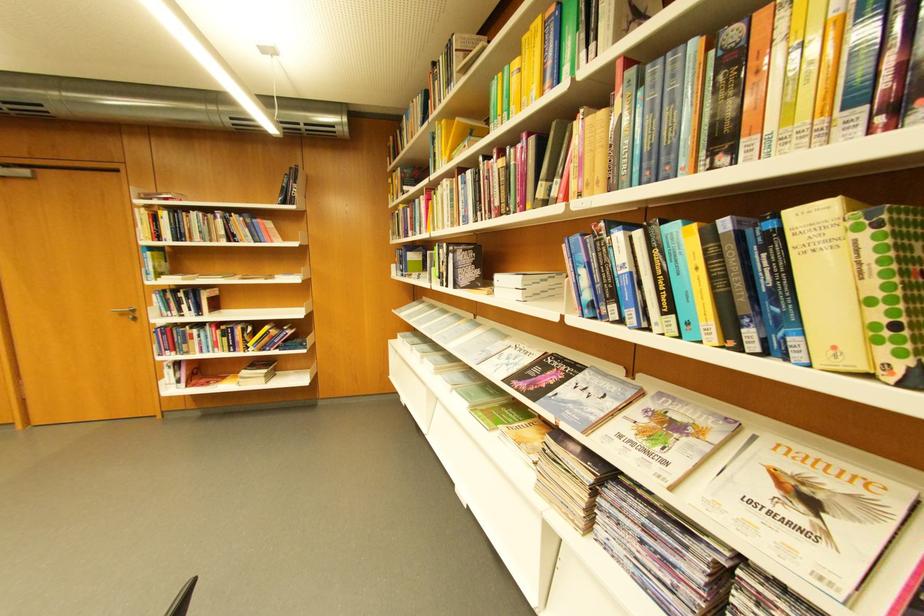
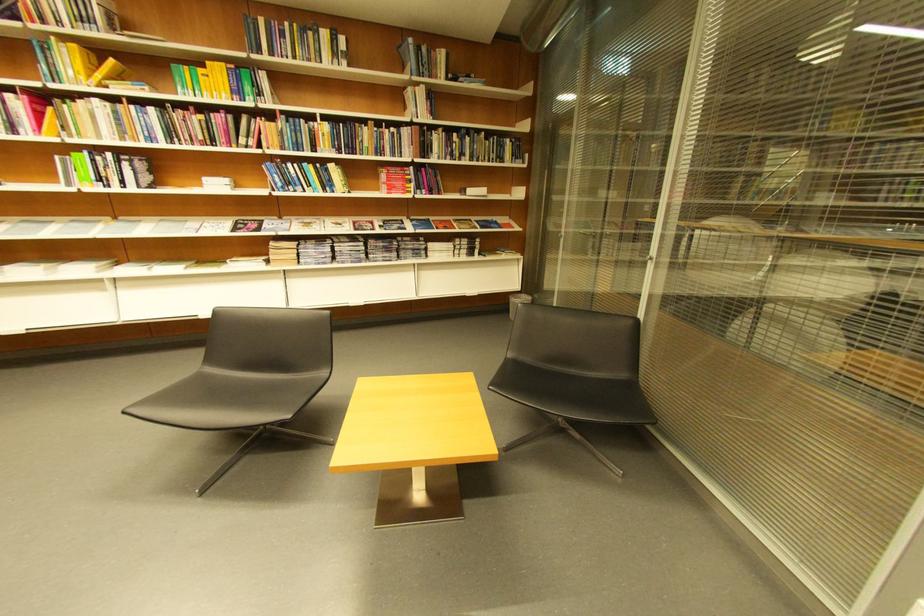
Find the pixel in the second image that matches the point at 454,124 in the first image.

(84, 47)